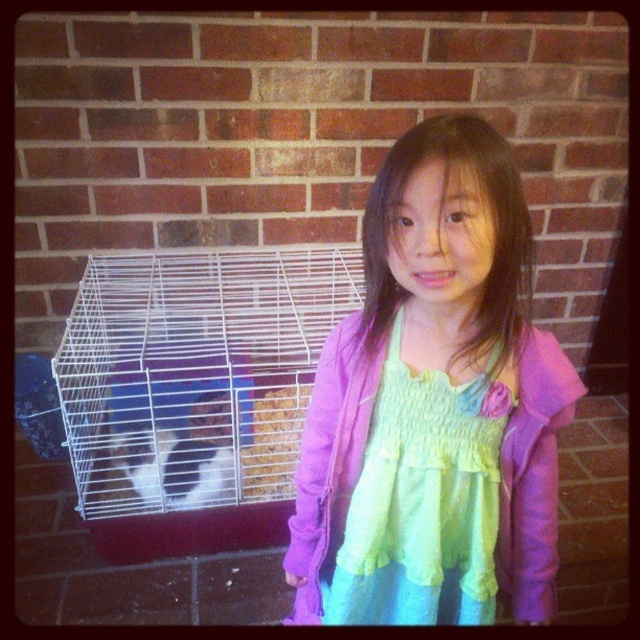
Who is positioned more to the right, white wire birdcage at left or white fur at center?

From the viewer's perspective, white wire birdcage at left appears more on the right side.

Which is behind, point (266, 518) or point (221, 394)?

The point (221, 394) is more distant.

I want to click on white wire birdcage at left, so click(x=195, y=392).

Measure the distance between purple satin dress at center and camera.

They are 29.87 inches apart.

Describe the element at coordinates (440, 362) in the screenshot. I see `purple satin dress at center` at that location.

What are the coordinates of `purple satin dress at center` in the screenshot? It's located at (440, 362).

Does white wire birdcage at left appear on the right side of pastel chiffon dress at center?

No, white wire birdcage at left is not to the right of pastel chiffon dress at center.

In the scene shown: Who is positioned more to the left, white wire birdcage at left or pastel chiffon dress at center?

white wire birdcage at left

Between point (138, 268) and point (344, 592), which one is positioned in front?

Point (344, 592) is more forward.

The image size is (640, 640). Identify the location of white wire birdcage at left. (195, 392).